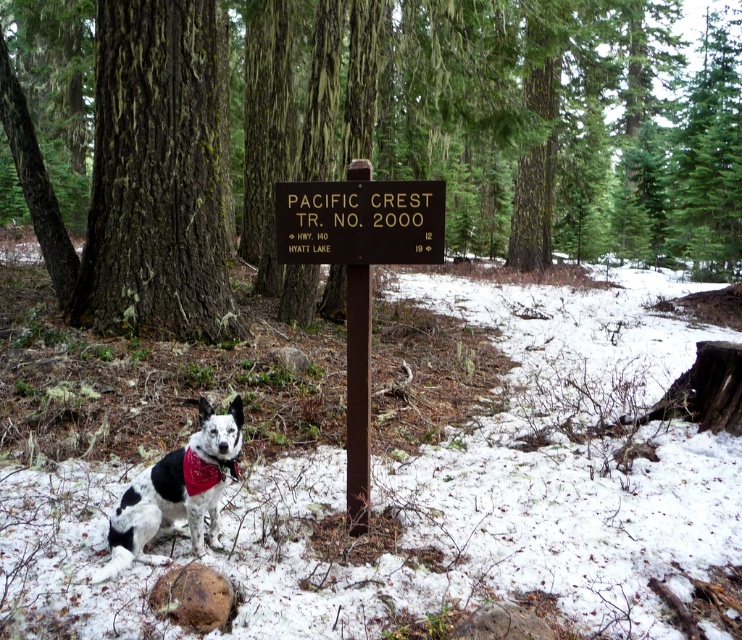
The image size is (742, 640). Describe the element at coordinates (154, 177) in the screenshot. I see `smooth bark tree at center` at that location.

Is point (220, 152) positioned in front of point (441, 256)?

No, it is behind (441, 256).

The image size is (742, 640). In order to click on smooth bark tree at center in this screenshot , I will do `click(154, 177)`.

Who is more distant from viewer, (x=413, y=99) or (x=122, y=115)?

Positioned behind is point (x=413, y=99).

I want to click on brown rough bark tree at center, so click(558, 125).

Looking at this image, is brown rough bark tree at center above spotted fur dog at lower left?

Correct, brown rough bark tree at center is located above spotted fur dog at lower left.

Is point (252, 168) positioned behind point (118, 516)?

Yes, it is.

Identify the location of brown rough bark tree at center. The width and height of the screenshot is (742, 640). (558, 125).